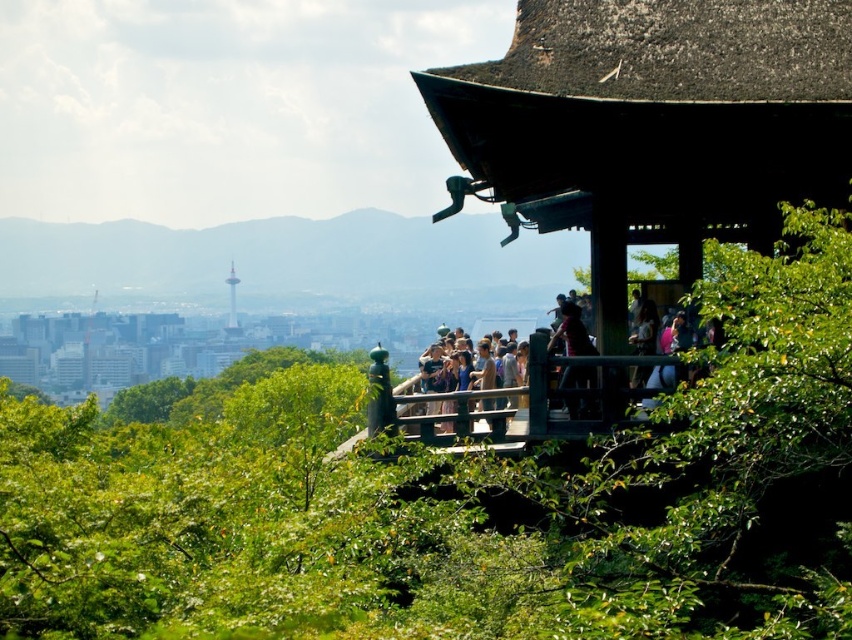
Question: Which object is farther from the camera taking this photo?

Choices:
 (A) multicolored casual clothing at center
 (B) green leafy mountain at upper left

Answer: (B)

Question: Can you confirm if green leafy trees at center is positioned to the right of green leafy mountain at upper left?

Choices:
 (A) no
 (B) yes

Answer: (B)

Question: Which point is closer to the camera?

Choices:
 (A) (134, 449)
 (B) (448, 371)
 (C) (453, 285)

Answer: (B)

Question: Is green leafy trees at center further to the viewer compared to multicolored casual clothing at center?

Choices:
 (A) yes
 (B) no

Answer: (B)

Question: Which object appears farthest from the camera in this image?

Choices:
 (A) green leafy mountain at upper left
 (B) green leafy trees at center
 (C) multicolored casual clothing at center

Answer: (A)

Question: Is green leafy trees at center closer to camera compared to multicolored casual clothing at center?

Choices:
 (A) no
 (B) yes

Answer: (B)